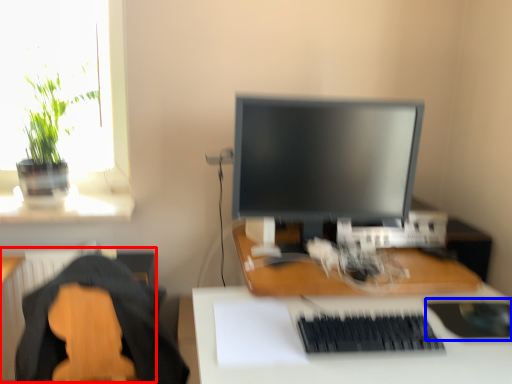
Question: Which point is further to the camera, radiator (highlighted by a red box) or mousepad (highlighted by a blue box)?

Choices:
 (A) radiator
 (B) mousepad

Answer: (B)